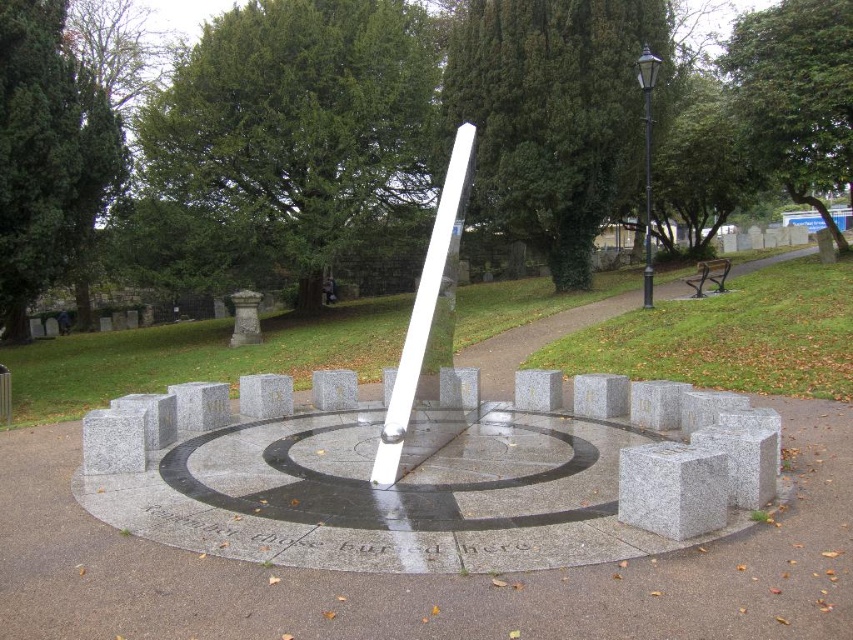
You are standing at the edge of the paved area and want to place a small decoration between the gray granite cube at lower right and the white polished stone candle at center. Can you fit it there?

The gray granite cube at lower right is in front of the white polished stone candle at center, so there is space between them where you can place the small decoration.

You are standing in front of the stone sundial in the park. There is a gray granite cube at lower right. A point is marked at coordinates (672, 490). Is this point located on the gray granite cube at lower right?

Yes, the point at coordinates (672, 490) is located on the gray granite cube at lower right as stated in the objects description.

You are standing in front of the stone sundial and want to take a photo that includes both the point at coordinates point (704, 458) and point (457, 182). Based on their positions, which point will appear larger in your photo?

Point (704, 458) is closer to the camera than point (457, 182), so it will appear larger in the photo.